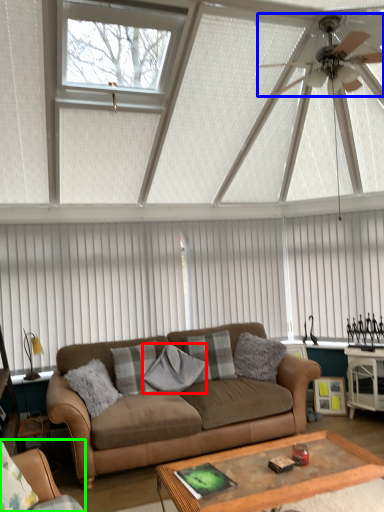
Question: Based on their relative distances, which object is farther from pillow (highlighted by a red box)? Choose from ceiling fan (highlighted by a blue box) and studio couch (highlighted by a green box).

Choices:
 (A) ceiling fan
 (B) studio couch

Answer: (A)